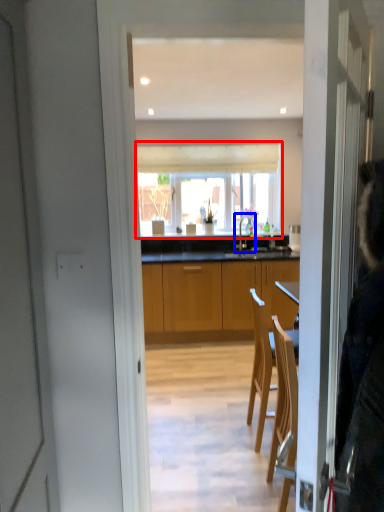
Question: Among these objects, which one is farthest to the camera, window (highlighted by a red box) or tap (highlighted by a blue box)?

Choices:
 (A) window
 (B) tap

Answer: (A)